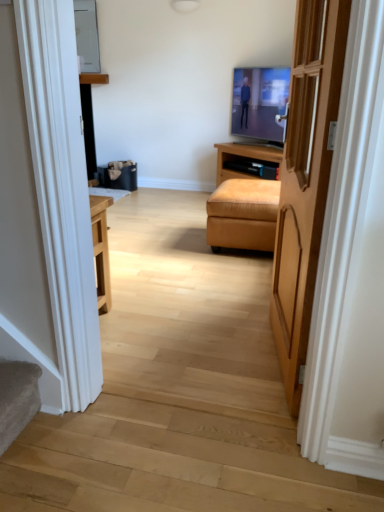
Question: Does suede-like tan ottoman at center touch flat screen tv at center?

Choices:
 (A) no
 (B) yes

Answer: (A)

Question: Could you tell me if suede-like tan ottoman at center is turned towards flat screen tv at center?

Choices:
 (A) no
 (B) yes

Answer: (A)

Question: Is suede-like tan ottoman at center behind flat screen tv at center?

Choices:
 (A) yes
 (B) no

Answer: (B)

Question: Can you confirm if suede-like tan ottoman at center is smaller than flat screen tv at center?

Choices:
 (A) no
 (B) yes

Answer: (A)

Question: Is suede-like tan ottoman at center not close to flat screen tv at center?

Choices:
 (A) yes
 (B) no

Answer: (A)

Question: Considering the relative sizes of suede-like tan ottoman at center and flat screen tv at center in the image provided, is suede-like tan ottoman at center wider than flat screen tv at center?

Choices:
 (A) yes
 (B) no

Answer: (A)

Question: From a real-world perspective, is suede-like tan ottoman at center located beneath light brown wooden door at center?

Choices:
 (A) no
 (B) yes

Answer: (B)

Question: Can you confirm if suede-like tan ottoman at center is thinner than light brown wooden door at center?

Choices:
 (A) no
 (B) yes

Answer: (A)

Question: Is suede-like tan ottoman at center located outside light brown wooden door at center?

Choices:
 (A) no
 (B) yes

Answer: (B)

Question: Considering the relative sizes of suede-like tan ottoman at center and light brown wooden door at center in the image provided, is suede-like tan ottoman at center wider than light brown wooden door at center?

Choices:
 (A) no
 (B) yes

Answer: (B)

Question: Is suede-like tan ottoman at center looking in the opposite direction of light brown wooden door at center?

Choices:
 (A) no
 (B) yes

Answer: (A)

Question: Considering the relative sizes of suede-like tan ottoman at center and light brown wooden door at center in the image provided, is suede-like tan ottoman at center taller than light brown wooden door at center?

Choices:
 (A) yes
 (B) no

Answer: (B)

Question: Does light brown wooden door at center come behind flat screen tv at center?

Choices:
 (A) no
 (B) yes

Answer: (A)